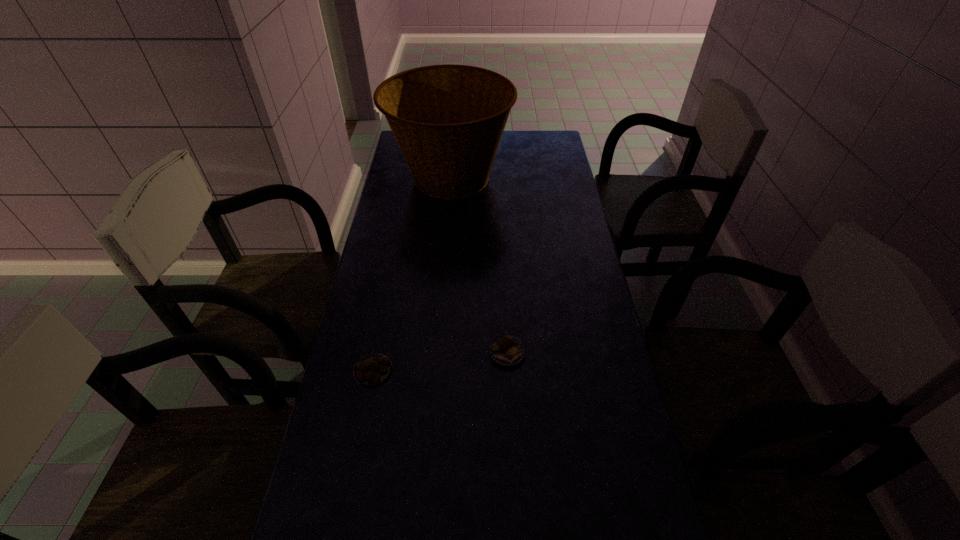
Find the location of a particular element. Image resolution: width=960 pixels, height=540 pixels. basket located in the left edge section of the desktop is located at coordinates (448, 120).

Where is `pastry located at the left edge`? This screenshot has width=960, height=540. pastry located at the left edge is located at coordinates (373, 369).

At what (x,y) coordinates should I click in order to perform the action: click on object positioned at the far left corner. Please return your answer as a coordinate pair (x, y). Looking at the image, I should click on (448, 120).

In the image, there is a desktop. Where is `vacant space at the left edge`? This screenshot has height=540, width=960. vacant space at the left edge is located at coordinates (394, 358).

Find the location of `free location at the right edge of the desktop`. free location at the right edge of the desktop is located at coordinates (610, 518).

At what (x,y) coordinates should I click in order to perform the action: click on free space at the far right corner of the desktop. Please return your answer as a coordinate pair (x, y). Looking at the image, I should click on (552, 145).

Locate an element on the screen. The width and height of the screenshot is (960, 540). free point between the tallest object and the shortest object is located at coordinates (412, 274).

You are a GUI agent. You are given a task and a screenshot of the screen. Output one action in this format:
    pyautogui.click(x=<x>, y=<y>)
    Task: Click on the free area in between the shortest object and the right pastry
    
    Given the screenshot: What is the action you would take?
    pyautogui.click(x=441, y=362)

Locate an element on the screen. Image resolution: width=960 pixels, height=540 pixels. unoccupied area between the basket and the right pastry is located at coordinates (479, 266).

Where is `free space between the basket and the second tallest object`? This screenshot has height=540, width=960. free space between the basket and the second tallest object is located at coordinates (479, 266).